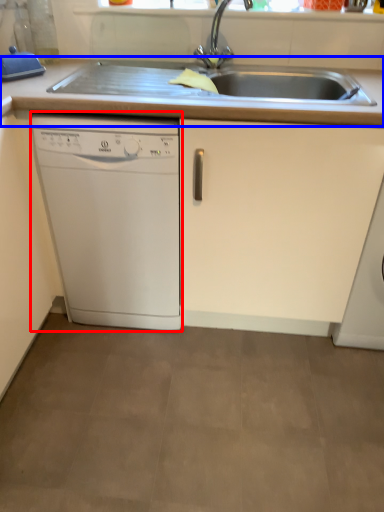
Question: Which object is closer to the camera taking this photo, home appliance (highlighted by a red box) or countertop (highlighted by a blue box)?

Choices:
 (A) home appliance
 (B) countertop

Answer: (B)